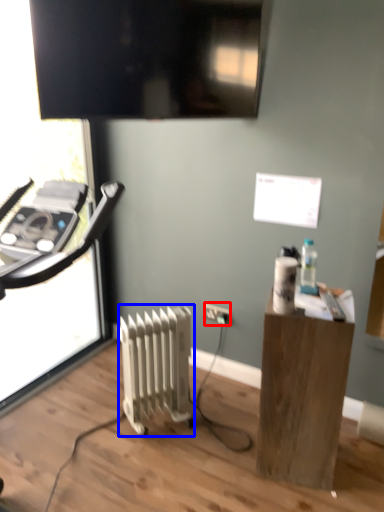
Question: Which object is further to the camera taking this photo, electric outlet (highlighted by a red box) or radiator (highlighted by a blue box)?

Choices:
 (A) electric outlet
 (B) radiator

Answer: (A)